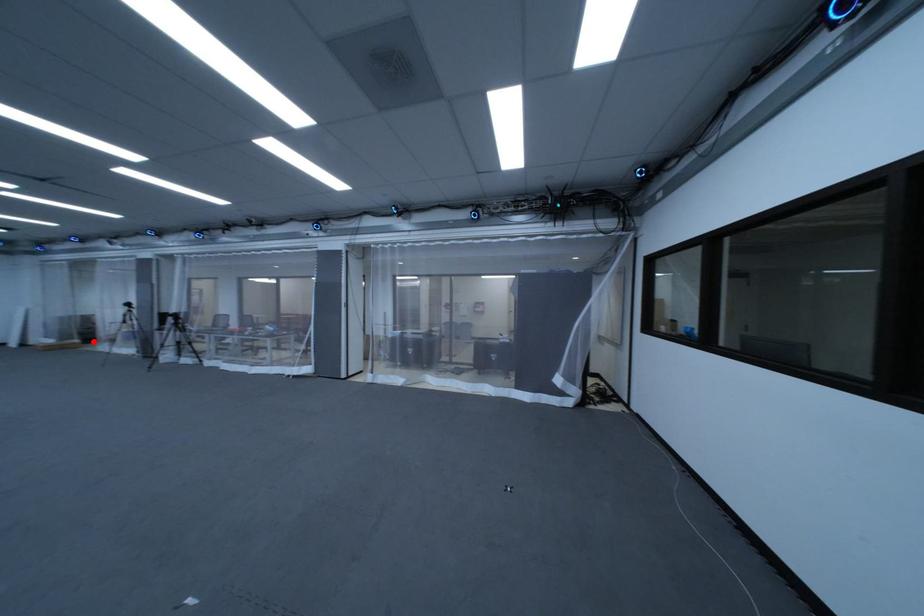
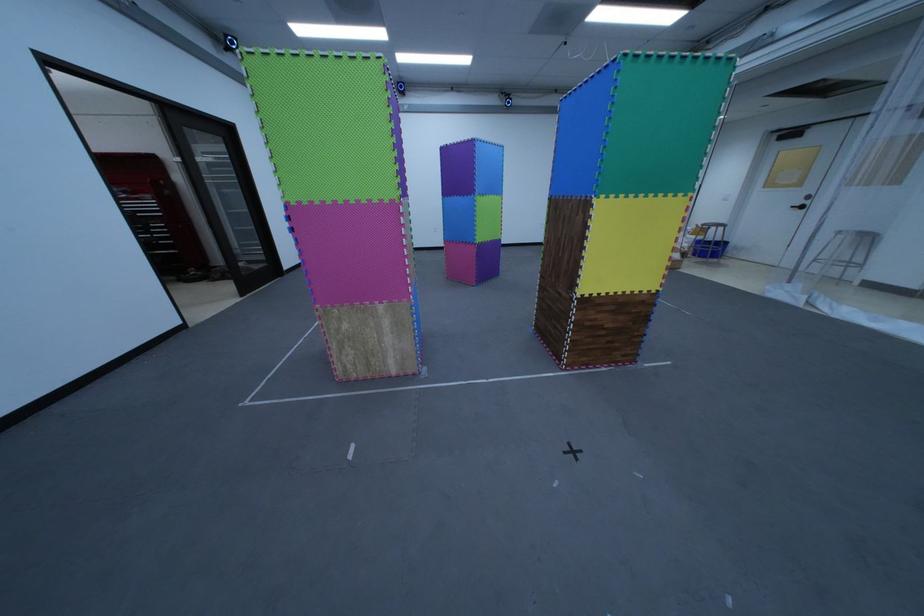
The point at the highlighted location is marked in the first image. Where is the corresponding point in the second image?

(691, 257)